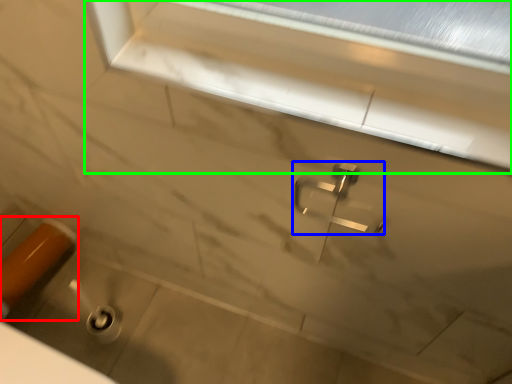
Question: Estimate the real-world distances between objects in this image. Which object is closer to door handle (highlighted by a red box), tap (highlighted by a blue box) or window frame (highlighted by a green box)?

Choices:
 (A) tap
 (B) window frame

Answer: (A)